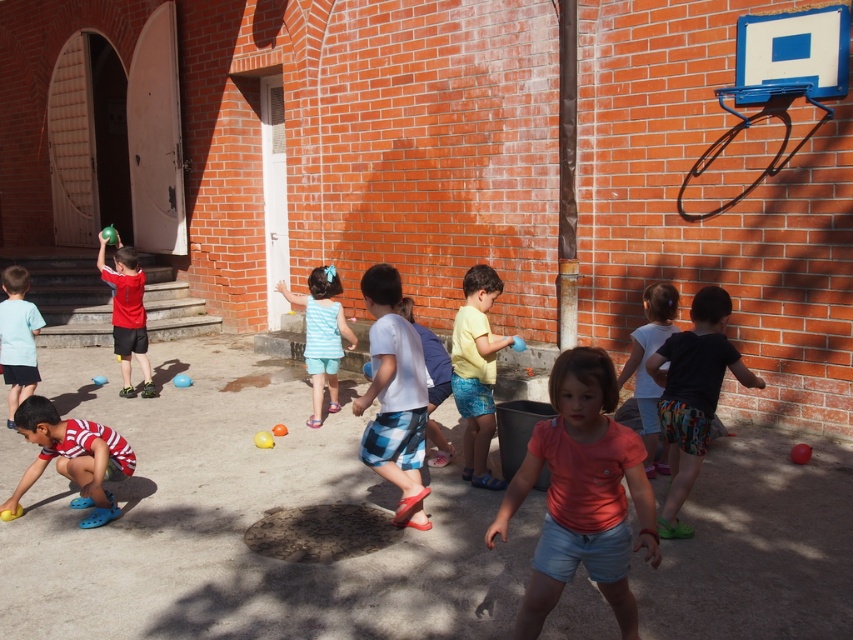
You are a photographer trying to capture a candid shot of the striped cotton shorts at center and the white plaid shorts at center. Since you want to ensure both are in focus, can you determine which one is higher up in the frame?

The striped cotton shorts at center is located above the white plaid shorts at center, so it is higher up in the frame.

You are a photographer trying to capture a candid shot of the striped cotton shirt at lower left and the white plaid shorts at center. Since you want to focus on the smaller object, which one should you aim your camera at?

The striped cotton shirt at lower left has a smaller size compared to the white plaid shorts at center, so you should aim your camera at the striped cotton shirt at lower left to focus on the smaller object.